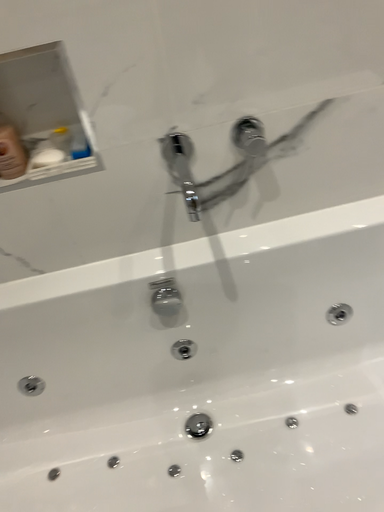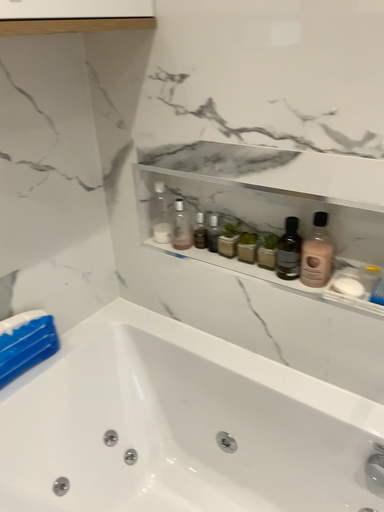
Question: Which way did the camera rotate in the video?

Choices:
 (A) rotated upward
 (B) rotated downward

Answer: (A)